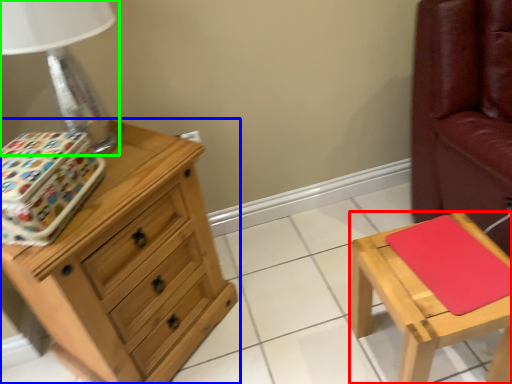
Question: Which object is positioned closest to stool (highlighted by a red box)? Select from chest of drawers (highlighted by a blue box) and table lamp (highlighted by a green box).

Choices:
 (A) chest of drawers
 (B) table lamp

Answer: (A)